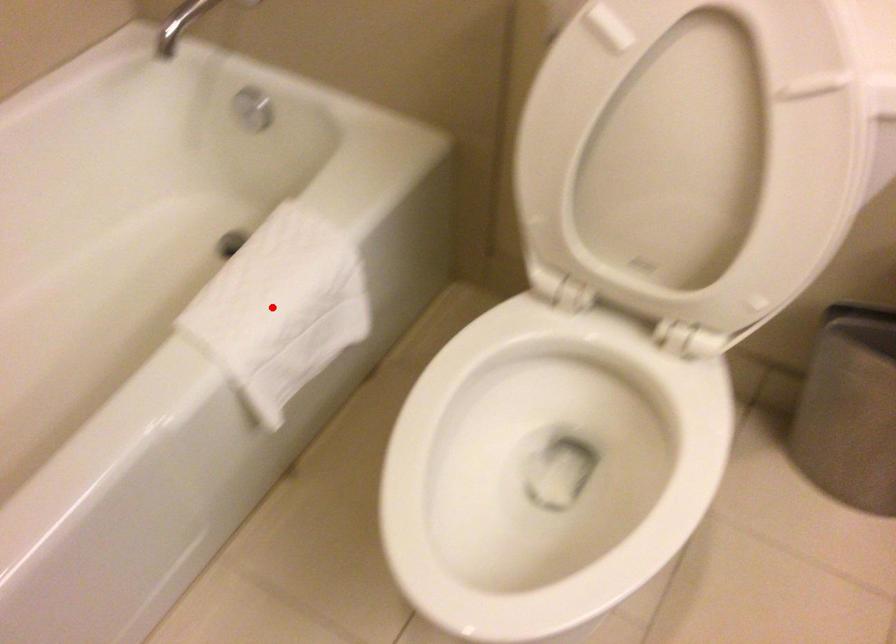
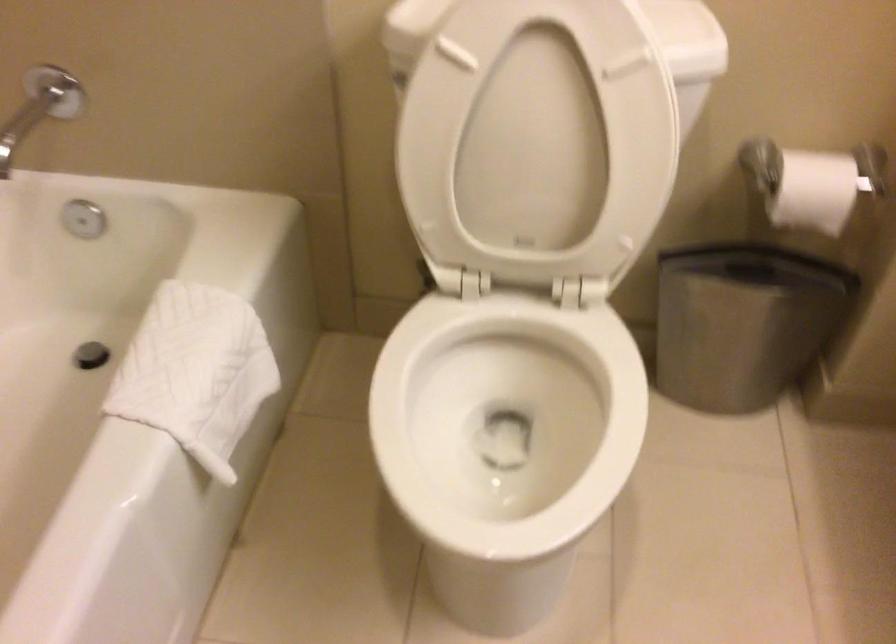
Locate, in the second image, the point that corresponds to the highlighted location in the first image.

(195, 372)